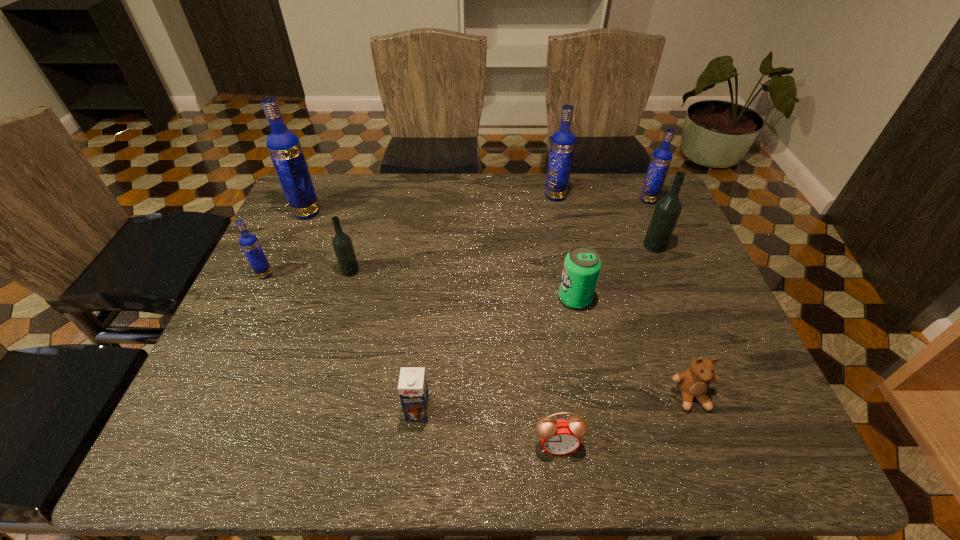
Identify the location of vacant space located 0.310m on the front of the third vodka from left to right. The image size is (960, 540). (319, 378).

Locate an element on the screen. The height and width of the screenshot is (540, 960). free space located 0.120m on the front-facing side of the seventh farthest object is located at coordinates (511, 298).

Find the location of a particular element. vacant space located on the front-facing side of the seventh farthest object is located at coordinates (511, 298).

You are a GUI agent. You are given a task and a screenshot of the screen. Output one action in this format:
    pyautogui.click(x=<x>, y=<y>)
    Task: Click on the blank area located on the front-facing side of the seventh farthest object
    
    Given the screenshot: What is the action you would take?
    pyautogui.click(x=448, y=298)

Image resolution: width=960 pixels, height=540 pixels. I want to click on chocolate milk that is at the near edge, so click(x=413, y=390).

Where is `alarm clock that is at the near edge`? This screenshot has height=540, width=960. alarm clock that is at the near edge is located at coordinates (559, 437).

Where is `teddy bear positioned at the right edge`? The width and height of the screenshot is (960, 540). teddy bear positioned at the right edge is located at coordinates (694, 382).

Where is `object present at the far left corner`? The image size is (960, 540). object present at the far left corner is located at coordinates (284, 147).

I want to click on object that is at the far right corner, so click(661, 159).

This screenshot has height=540, width=960. In the image, there is a desktop. Find the location of `free space at the far edge`. free space at the far edge is located at coordinates click(x=578, y=200).